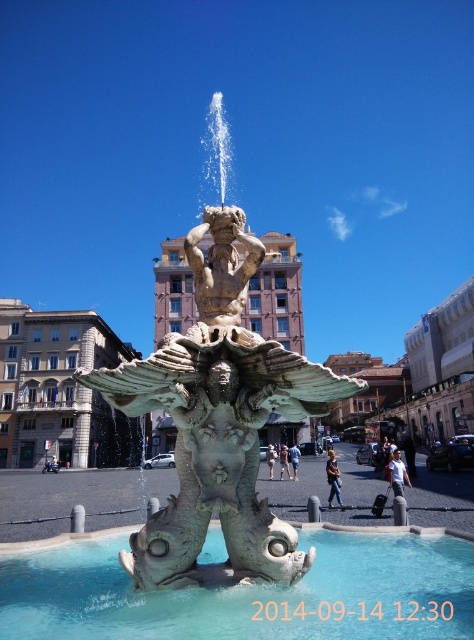
You are a tourist standing in front of the fountain. You want to take a photo that captures both the clear glass water at center and the white marble statue at center. Which object will appear taller in the photo?

The white marble statue at center will appear taller in the photo because it is taller than the clear glass water at center.

You are a tourist standing in front of the fountain and want to take a photo of both the bronze statue at center and the white marble statue at center. Which statue should you focus on first to ensure both are in the frame?

You should focus on the white marble statue at center first since it is lower and the bronze statue at center is above it, ensuring both are visible in the frame.

You are a city planner assessing the fountain in the image. The clear glass water at center and the white marble statue at center are both central features. Which one has a greater width?

The clear glass water at center has a greater width than the white marble statue at center.